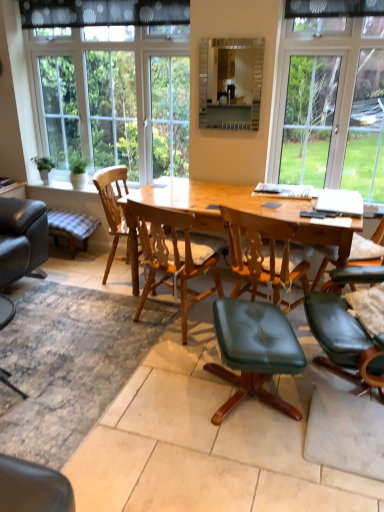
Where is `free space in front of green leather stool at center, which is counted as the third chair, starting from the back`? free space in front of green leather stool at center, which is counted as the third chair, starting from the back is located at coordinates (257, 466).